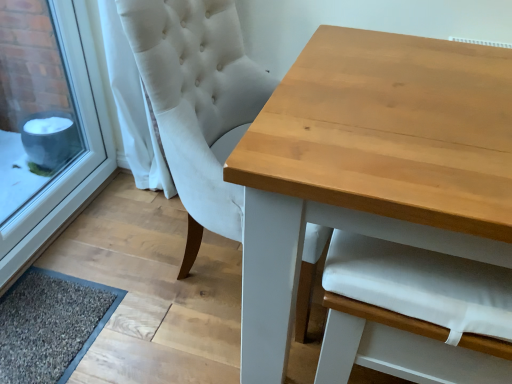
Question: Is white plastic window frame at lower left outside white fabric chair at upper center?

Choices:
 (A) no
 (B) yes

Answer: (B)

Question: Is white plastic window frame at lower left aimed at white fabric chair at upper center?

Choices:
 (A) no
 (B) yes

Answer: (B)

Question: Is white plastic window frame at lower left at the right side of white fabric chair at upper center?

Choices:
 (A) no
 (B) yes

Answer: (A)

Question: Is white plastic window frame at lower left next to white fabric chair at upper center?

Choices:
 (A) yes
 (B) no

Answer: (B)

Question: Is white plastic window frame at lower left in front of white fabric chair at upper center?

Choices:
 (A) yes
 (B) no

Answer: (B)

Question: Looking at their shapes, would you say white fabric armchair at center is wider or thinner than white fabric curtain at left?

Choices:
 (A) thin
 (B) wide

Answer: (B)

Question: Would you say white fabric armchair at center is inside or outside white fabric curtain at left?

Choices:
 (A) inside
 (B) outside

Answer: (B)

Question: Is point (334, 362) positioned closer to the camera than point (155, 178)?

Choices:
 (A) farther
 (B) closer

Answer: (B)

Question: In terms of height, does white fabric armchair at center look taller or shorter compared to white fabric curtain at left?

Choices:
 (A) tall
 (B) short

Answer: (B)

Question: Is white fabric chair at upper center wider or thinner than light brown wooden table at center?

Choices:
 (A) wide
 (B) thin

Answer: (B)

Question: In the image, is white fabric chair at upper center positioned in front of or behind light brown wooden table at center?

Choices:
 (A) front
 (B) behind

Answer: (B)

Question: In terms of size, does white fabric chair at upper center appear bigger or smaller than light brown wooden table at center?

Choices:
 (A) small
 (B) big

Answer: (A)

Question: From a real-world perspective, is white fabric chair at upper center above or below light brown wooden table at center?

Choices:
 (A) above
 (B) below

Answer: (A)

Question: Is white fabric armchair at center taller or shorter than dark gray textured mat at lower left?

Choices:
 (A) short
 (B) tall

Answer: (B)

Question: From a real-world perspective, is white fabric armchair at center positioned above or below dark gray textured mat at lower left?

Choices:
 (A) below
 (B) above

Answer: (B)